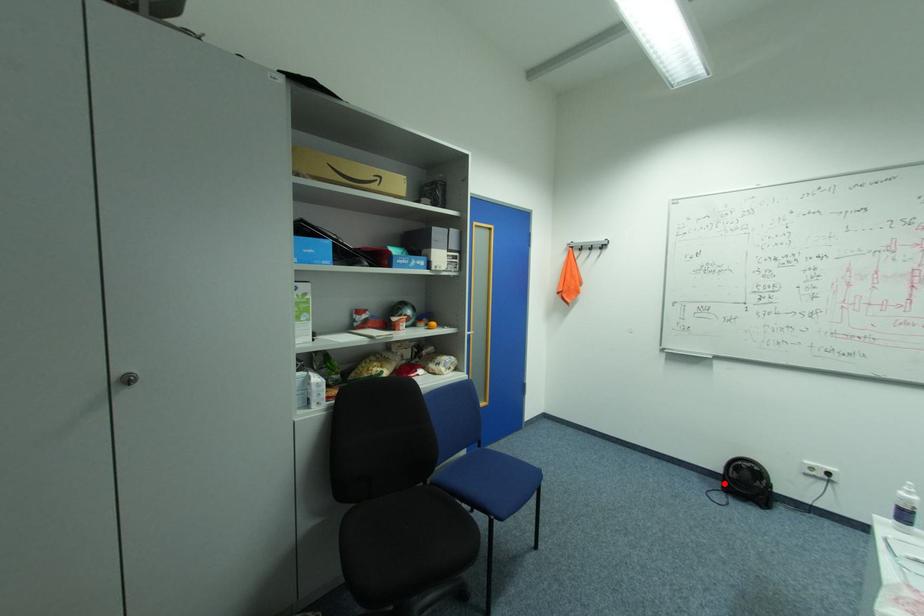
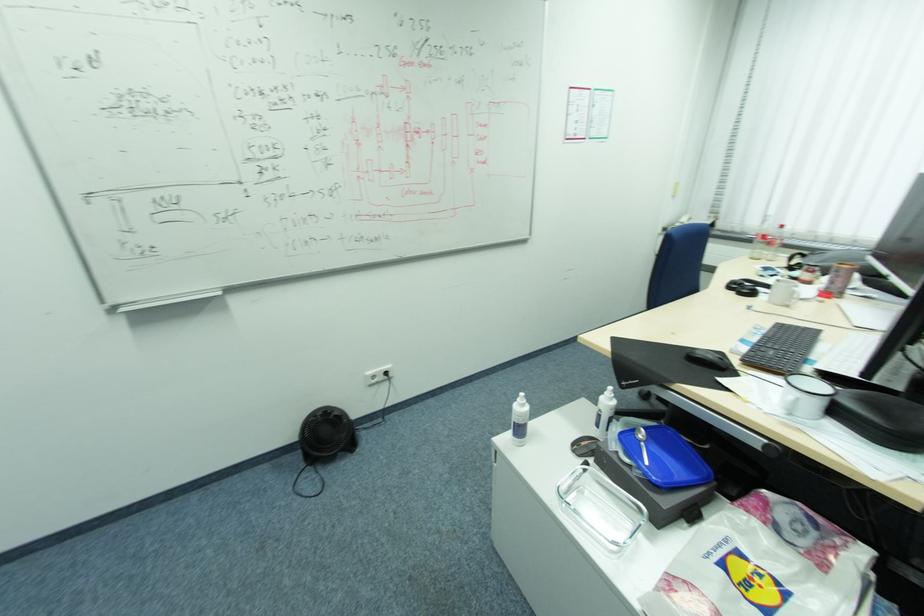
Question: I am providing you with two images of the same scene from different viewpoints. A red point is shown in image1. For the corresponding object point in image2, is it positioned nearer or farther from the camera?

Choices:
 (A) Nearer
 (B) Farther

Answer: (B)